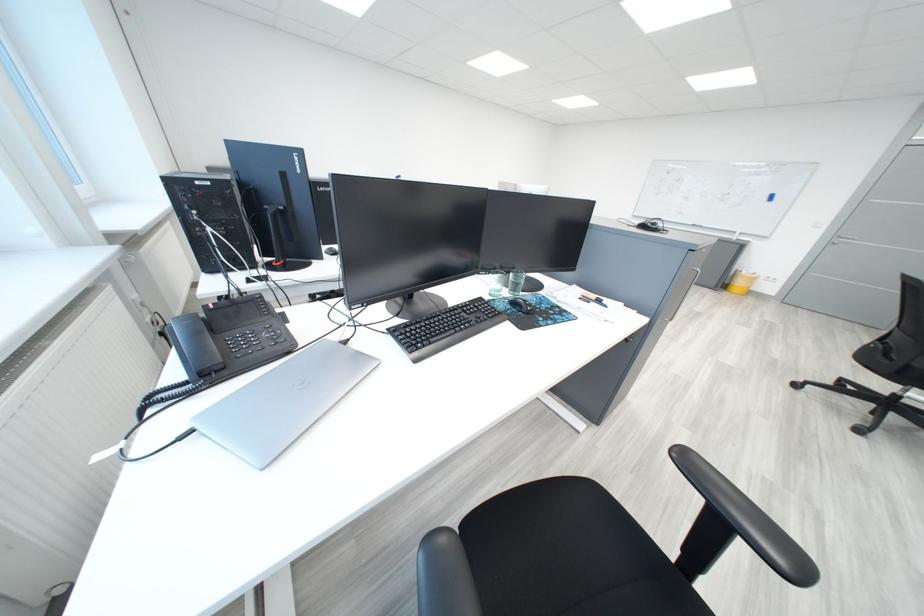
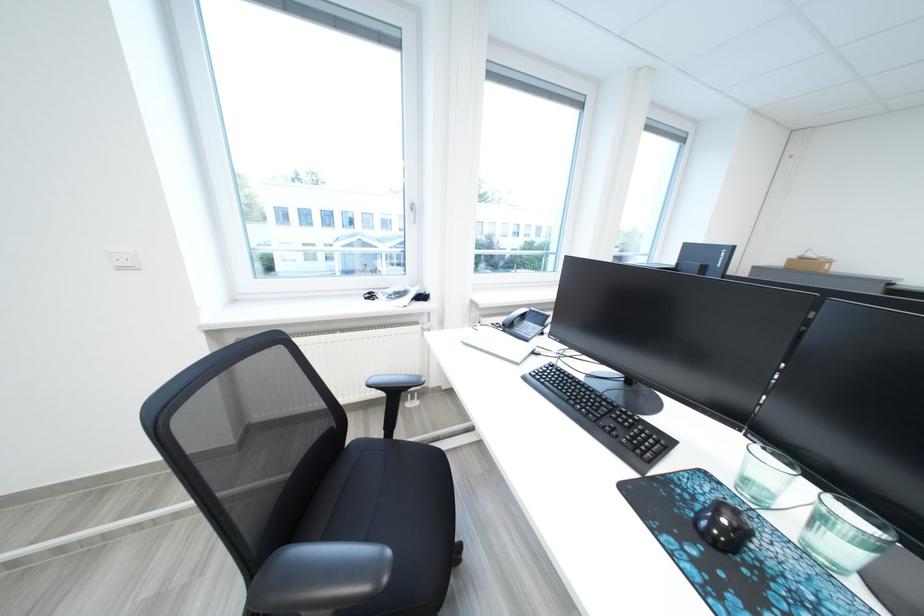
The first image is from the beginning of the video and the second image is from the end. How did the camera likely rotate when shooting the video?

The rotation direction of the camera is left-down.